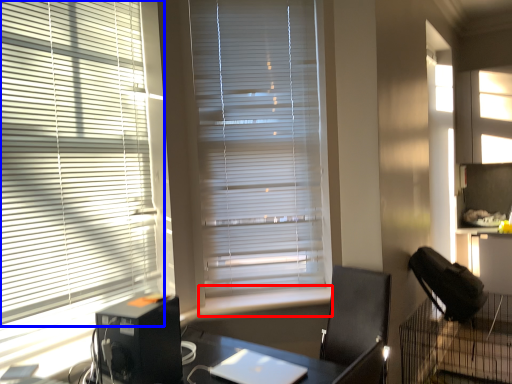
Question: Which point is further to the camera, window sill (highlighted by a red box) or window blind (highlighted by a blue box)?

Choices:
 (A) window sill
 (B) window blind

Answer: (A)